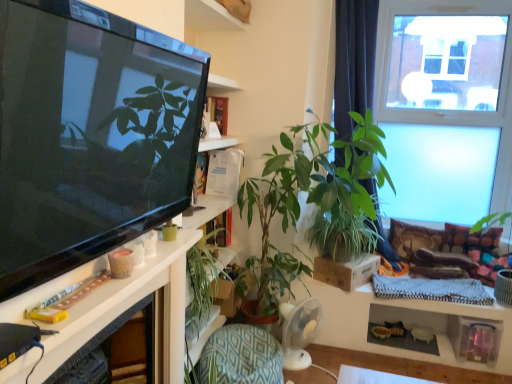
Question: From a real-world perspective, is green leafy plant at center, placed as the second houseplant when sorted from left to right, positioned above or below green textured cushion at lower center?

Choices:
 (A) below
 (B) above

Answer: (B)

Question: Is green leafy plant at center, placed as the second houseplant when sorted from left to right, taller or shorter than green textured cushion at lower center?

Choices:
 (A) tall
 (B) short

Answer: (A)

Question: Considering the real-world distances, which object is closest to the green textured cushion at lower center?

Choices:
 (A) white glossy shelf at left
 (B) green leafy plant at center, placed as the second houseplant when sorted from left to right
 (C) green leafy plant at center, the 2th houseplant positioned from the right
 (D) transparent glass window at upper right

Answer: (C)

Question: Considering the real-world distances, which object is closest to the white glossy shelf at left?

Choices:
 (A) green leafy plant at center, which is the first houseplant in right-to-left order
 (B) green leafy plant at center, the 2th houseplant positioned from the right
 (C) transparent glass window at upper right
 (D) green textured cushion at lower center

Answer: (B)